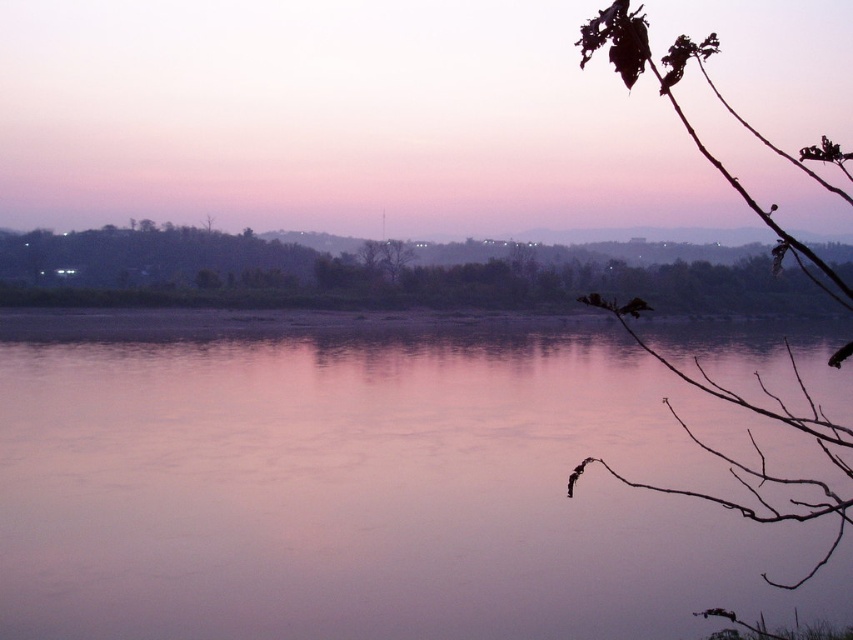
Based on the scene description, what is the 2D coordinate of the smooth water at center?

The smooth water at center is located at the 2D coordinate point of (372, 483).

Based on the scene description, where is the smooth water at center located in terms of coordinates?

The smooth water at center is located at the coordinates point (372,483).